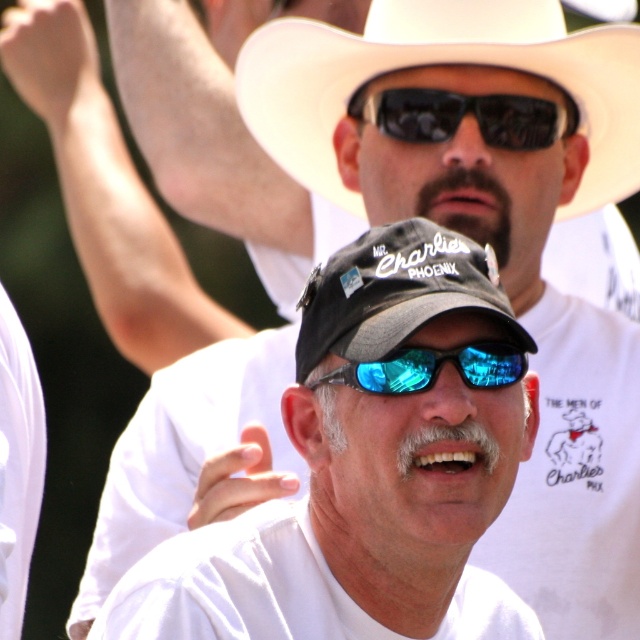
You are a photographer trying to capture a closeup of the black reflective sunglasses at center. You notice the white matte cowboy hat at upper center might block your view. Can you confirm if the cowboy hat is wider than the sunglasses?

The white matte cowboy hat at upper center might be wider than black reflective sunglasses at center, so there is a possibility that the cowboy hat could block the view of the sunglasses.

You are a photographer at the event and want to capture both the white matte cowboy hat at upper center and the black fabric baseball cap at center in a single photo. Which hat will appear taller in the photo?

A: The white matte cowboy hat at upper center will appear taller in the photo because it has a greater height compared to the black fabric baseball cap at center.

You are designing a display case for a sports memorabilia store. The display case must accommodate both the black matte cap at center and the black reflective sunglasses at center. Given their sizes, which item should be placed first to ensure they both fit properly?

The black reflective sunglasses at center should be placed first since the black matte cap at center is larger and will require more space, allowing the sunglasses to fit alongside it without overcrowding.